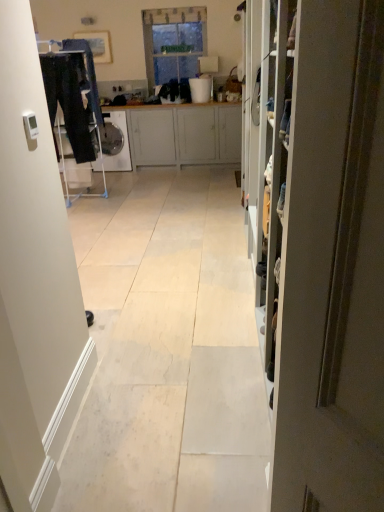
Question: From the image's perspective, is dark blue jeans at left below matte gray door at right?

Choices:
 (A) no
 (B) yes

Answer: (A)

Question: Is dark blue jeans at left positioned with its back to matte gray door at right?

Choices:
 (A) yes
 (B) no

Answer: (B)

Question: Does dark blue jeans at left have a lesser height compared to matte gray door at right?

Choices:
 (A) no
 (B) yes

Answer: (A)

Question: Does dark blue jeans at left turn towards matte gray door at right?

Choices:
 (A) yes
 (B) no

Answer: (B)

Question: Is dark blue jeans at left to the right of matte gray door at right from the viewer's perspective?

Choices:
 (A) yes
 (B) no

Answer: (B)

Question: Is dark blue jeans at left wider than matte gray door at right?

Choices:
 (A) yes
 (B) no

Answer: (A)

Question: Are light gray wood cabinet at center and matte gray door at right far apart?

Choices:
 (A) yes
 (B) no

Answer: (A)

Question: Considering the relative sizes of light gray wood cabinet at center and matte gray door at right in the image provided, is light gray wood cabinet at center thinner than matte gray door at right?

Choices:
 (A) no
 (B) yes

Answer: (A)

Question: From the image's perspective, is light gray wood cabinet at center located beneath matte gray door at right?

Choices:
 (A) no
 (B) yes

Answer: (A)

Question: From a real-world perspective, does light gray wood cabinet at center stand above matte gray door at right?

Choices:
 (A) yes
 (B) no

Answer: (B)

Question: Is the depth of light gray wood cabinet at center greater than that of matte gray door at right?

Choices:
 (A) yes
 (B) no

Answer: (A)

Question: Is light gray wood cabinet at center taller than matte gray door at right?

Choices:
 (A) yes
 (B) no

Answer: (B)

Question: Is white plastic bucket at upper center facing away from clear glass window at center?

Choices:
 (A) no
 (B) yes

Answer: (B)